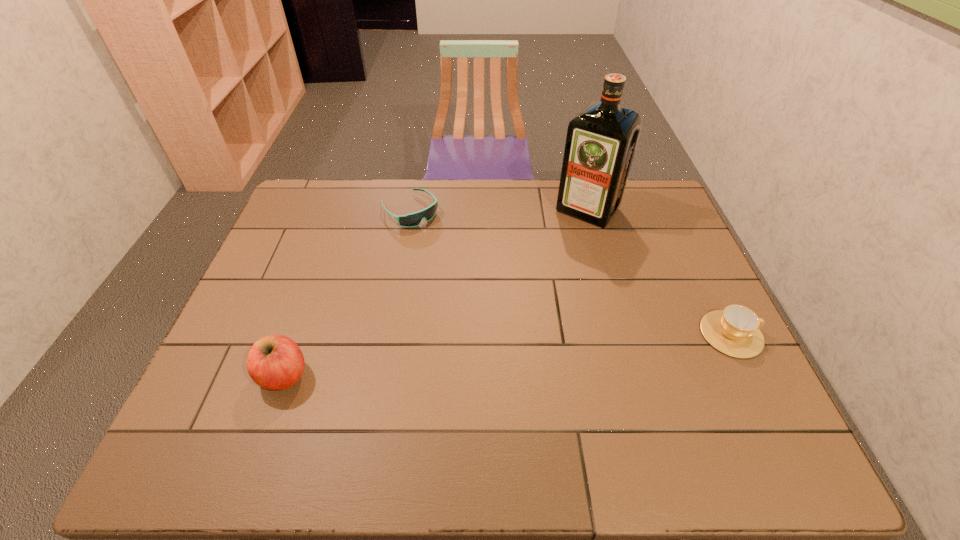
At what (x,y) coordinates should I click in order to perform the action: click on free space that satisfies the following two spatial constraints: 1. on the front side of the tallest object; 2. with the handle on the side of the rightmost object. Please return your answer as a coordinate pair (x, y). This screenshot has width=960, height=540. Looking at the image, I should click on (622, 334).

This screenshot has width=960, height=540. Identify the location of free point that satisfies the following two spatial constraints: 1. on the front side of the rightmost object; 2. with the handle on the side of the sunglasses. [388, 334].